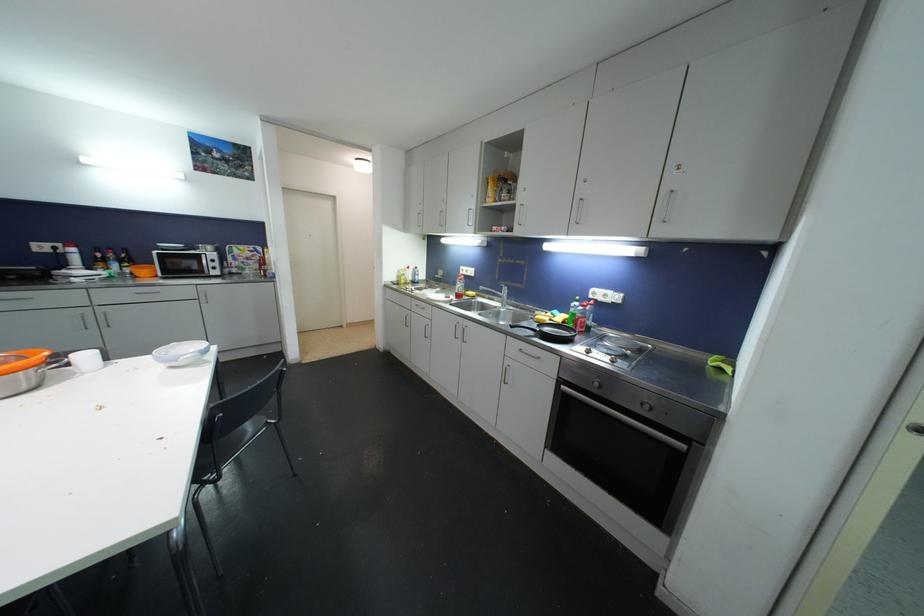
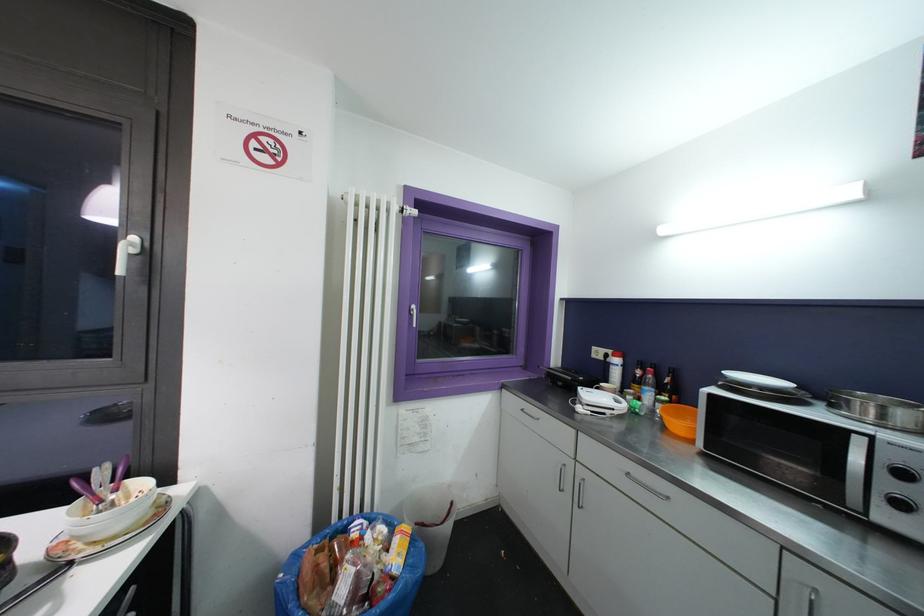
Where in the second image is the point corresponding to point (107, 262) from the first image?

(642, 385)